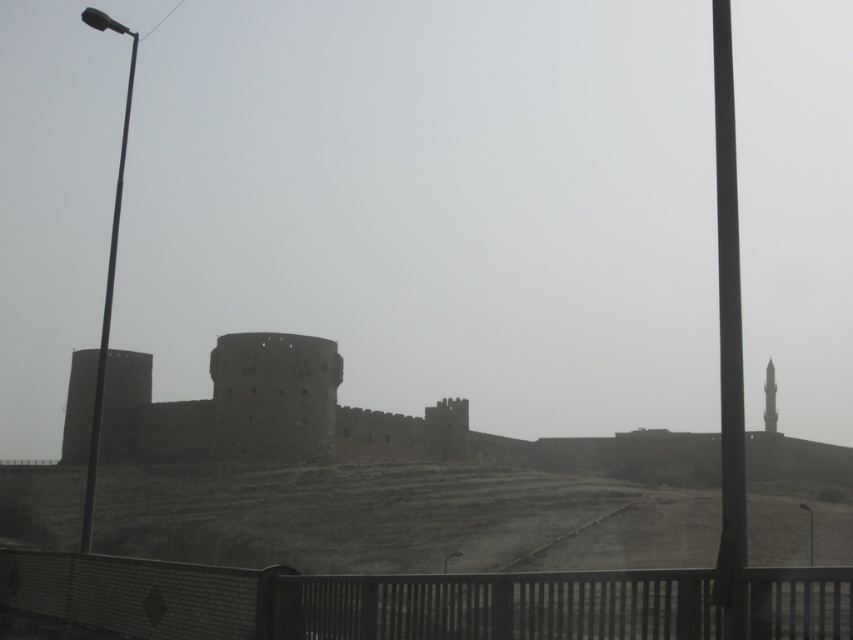
You are standing in front of the fortress and see two points marked in the image. The first point is at coordinate point (776, 637) and the second is at point (345, 413). Which point is closer to your current position?

Point (776, 637) is closer to the camera than point (345, 413), so the first point is closer to your current position.

You are standing in front of the metal fence and want to locate the brown stone castle at center. According to the coordinates given, where exactly is it positioned?

The brown stone castle at center is located at the coordinate point of (265, 408).

You are a drone operator tasked with flying a drone through the scene. The drone must navigate between the brown stone castle at center and the smooth stone minaret at center. Which object should the drone fly under to avoid collision?

The drone should fly under the brown stone castle at center because it is positioned over the smooth stone minaret at center, so the minaret is lower and the castle is above it.